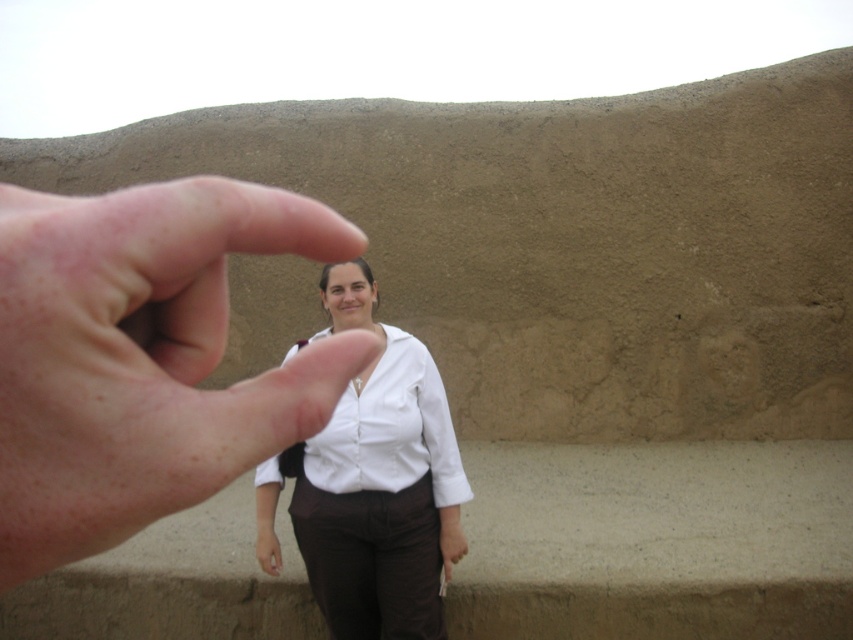
Is skinny flesh-toned finger at center bigger than white smooth shirt at center?

Actually, skinny flesh-toned finger at center might be smaller than white smooth shirt at center.

Can you confirm if skinny flesh-toned finger at center is thinner than white smooth shirt at center?

Yes.

Image resolution: width=853 pixels, height=640 pixels. What do you see at coordinates (142, 356) in the screenshot?
I see `skinny flesh-toned finger at center` at bounding box center [142, 356].

Where is `skinny flesh-toned finger at center`? This screenshot has width=853, height=640. skinny flesh-toned finger at center is located at coordinates (142, 356).

Describe the element at coordinates (373, 484) in the screenshot. I see `white matte shirt at center` at that location.

Is the position of white matte shirt at center less distant than that of white smooth shirt at center?

No, it is not.

Does point (404, 496) come behind point (415, 374)?

That is False.

This screenshot has height=640, width=853. Find the location of `white matte shirt at center`. white matte shirt at center is located at coordinates (373, 484).

Which is more to the right, skinny flesh-toned finger at center or white matte shirt at center?

From the viewer's perspective, skinny flesh-toned finger at center appears more on the right side.

Which is in front, point (16, 548) or point (379, 563)?

Positioned in front is point (16, 548).

Between point (3, 284) and point (357, 548), which one is positioned behind?

Point (357, 548)

Find the location of a particular element. The width and height of the screenshot is (853, 640). skinny flesh-toned finger at center is located at coordinates (142, 356).